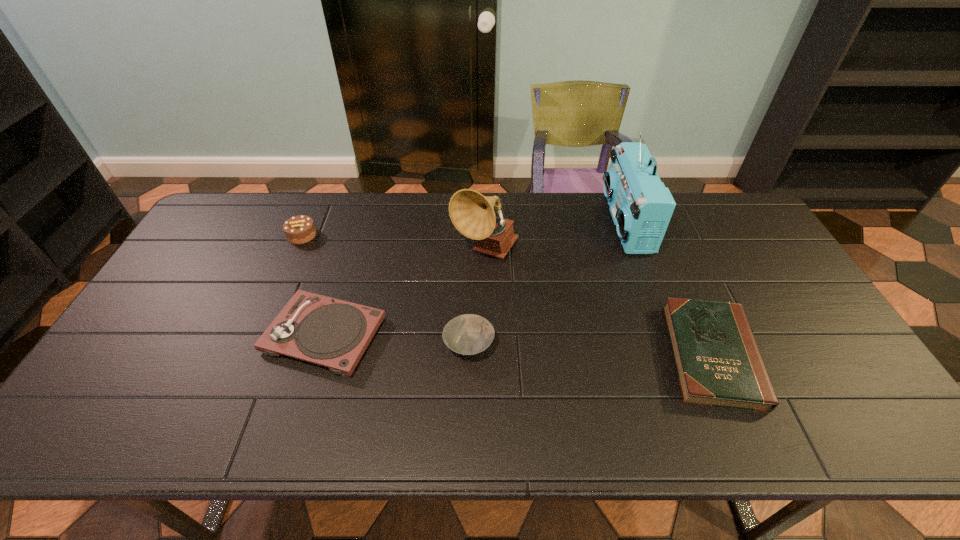
Where is `vacant region between the Bible and the bowl`? Image resolution: width=960 pixels, height=540 pixels. vacant region between the Bible and the bowl is located at coordinates (590, 350).

Locate an element on the screen. This screenshot has width=960, height=540. vacant area between the radio receiver and the bowl is located at coordinates (547, 284).

Find the location of `free space between the taller phonograph_record and the bowl`. free space between the taller phonograph_record and the bowl is located at coordinates (477, 298).

Locate an element on the screen. Image resolution: width=960 pixels, height=540 pixels. object that is the second closest to the right phonograph_record is located at coordinates (469, 334).

The height and width of the screenshot is (540, 960). Find the location of `object that is the fourth closest one to the shorter phonograph_record`. object that is the fourth closest one to the shorter phonograph_record is located at coordinates (641, 206).

Find the location of a particular element. vacant space that satisfies the following two spatial constraints: 1. on the front-facing side of the radio receiver; 2. on the front side of the bowl is located at coordinates click(x=670, y=345).

The height and width of the screenshot is (540, 960). In order to click on free location that satisfies the following two spatial constraints: 1. on the front-facing side of the radio receiver; 2. on the front side of the bowl in this screenshot , I will do `click(670, 345)`.

What are the coordinates of `vacant space that satisfies the following two spatial constraints: 1. on the front side of the Bible; 2. on the left side of the shorter phonograph_record` in the screenshot? It's located at (318, 355).